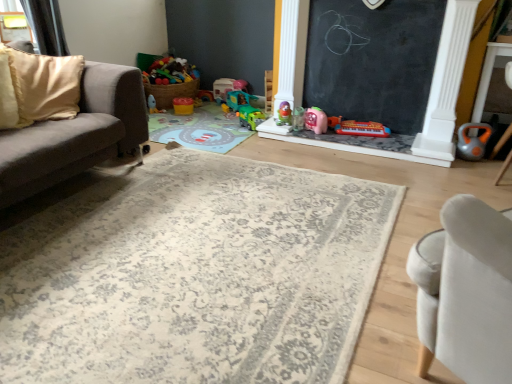
Locate an element on the screen. Image resolution: width=512 pixels, height=384 pixels. pink rubber duck at center, arranged as the eighth toy when viewed from the left is located at coordinates (316, 120).

What do you see at coordinates (316, 120) in the screenshot? This screenshot has height=384, width=512. I see `pink rubber duck at center, positioned as the third toy in right-to-left order` at bounding box center [316, 120].

Describe the element at coordinates (222, 88) in the screenshot. I see `plastic train at upper center, positioned as the 8th toy in right-to-left order` at that location.

Measure the distance between plastic train at upper center, positioned as the 8th toy in right-to-left order, and camera.

3.74 meters.

Locate an element on the screen. The width and height of the screenshot is (512, 384). translucent plastic cup at center, the seventh toy from the left is located at coordinates (298, 119).

Is beige fabric pillow at left not near matte plastic toy at center, which appears as the sixth toy when viewed from the left?

Yes.

Is point (26, 92) behind point (282, 125)?

No.

Considering the sizes of objects beige fabric pillow at left and matte plastic toy at center, the fifth toy from the right, in the image provided, who is taller, beige fabric pillow at left or matte plastic toy at center, the fifth toy from the right,?

With more height is beige fabric pillow at left.

You are a GUI agent. You are given a task and a screenshot of the screen. Output one action in this format:
    pyautogui.click(x=<x>, y=<y>)
    Task: Click on the pillow above the matte plastic toy at center, which appears as the sixth toy when viewed from the left (from a real-world perspective)
    This screenshot has width=512, height=384.
    Given the screenshot: What is the action you would take?
    pyautogui.click(x=37, y=87)

Considering the sizes of objects beige floral rug at center and matte plastic toy at center, which appears as the sixth toy when viewed from the left, in the image provided, who is bigger, beige floral rug at center or matte plastic toy at center, which appears as the sixth toy when viewed from the left,?

Bigger between the two is beige floral rug at center.

From the picture: Between beige floral rug at center and matte plastic toy at center, the fifth toy from the right, which one has smaller width?

Thinner between the two is matte plastic toy at center, the fifth toy from the right.

Does beige floral rug at center contain matte plastic toy at center, the fifth toy from the right?

Definitely not — matte plastic toy at center, the fifth toy from the right, is not inside beige floral rug at center.

Consider the image. Which is behind, beige floral rug at center or matte plastic toy at center, which appears as the sixth toy when viewed from the left?

matte plastic toy at center, which appears as the sixth toy when viewed from the left.

Considering the positions of objects green plastic toy car at center, which ranks as the fifth toy in left-to-right order, and beige fabric couch at left in the image provided, who is behind, green plastic toy car at center, which ranks as the fifth toy in left-to-right order, or beige fabric couch at left?

green plastic toy car at center, which ranks as the fifth toy in left-to-right order, is further away from the camera.

Can you tell me how much green plastic toy car at center, which is the 6th toy from right to left, and beige fabric couch at left differ in facing direction?

The facing directions of green plastic toy car at center, which is the 6th toy from right to left, and beige fabric couch at left are 120 degrees apart.

From a real-world perspective, is green plastic toy car at center, which ranks as the fifth toy in left-to-right order, physically below beige fabric couch at left?

Yes, from a real-world perspective, green plastic toy car at center, which ranks as the fifth toy in left-to-right order, is beneath beige fabric couch at left.

Is green plastic toy car at center, which ranks as the fifth toy in left-to-right order, positioned with its back to beige fabric couch at left?

No, green plastic toy car at center, which ranks as the fifth toy in left-to-right order, is not facing away from beige fabric couch at left.

Between green plastic toy car at center, which is the 6th toy from right to left, and beige fabric pillow at left, which one is positioned behind?

green plastic toy car at center, which is the 6th toy from right to left, is further from the camera.

Is green plastic toy car at center, which ranks as the fifth toy in left-to-right order, aimed at beige fabric pillow at left?

Yes, green plastic toy car at center, which ranks as the fifth toy in left-to-right order, is oriented towards beige fabric pillow at left.

From the image's perspective, which is below, green plastic toy car at center, which ranks as the fifth toy in left-to-right order, or beige fabric pillow at left?

green plastic toy car at center, which ranks as the fifth toy in left-to-right order.

From the image's perspective, who appears lower, plastic train at upper center, positioned as the 8th toy in right-to-left order, or beige fabric pillow at left?

beige fabric pillow at left appears lower in the image.

Is plastic train at upper center, marked as the 3th toy in a left-to-right arrangement, inside the boundaries of beige fabric pillow at left, or outside?

plastic train at upper center, marked as the 3th toy in a left-to-right arrangement, is spatially situated outside beige fabric pillow at left.

Is there a large distance between plastic train at upper center, positioned as the 8th toy in right-to-left order, and beige fabric pillow at left?

Yes, plastic train at upper center, positioned as the 8th toy in right-to-left order, and beige fabric pillow at left are located far from each other.

Based on their positions, is orange rubber kettlebell at right, the tenth toy from the left, located to the left or right of beige fabric pillow at left?

From the image, it's evident that orange rubber kettlebell at right, the tenth toy from the left, is to the right of beige fabric pillow at left.

Looking at this image, is orange rubber kettlebell at right, placed as the 1th toy when sorted from right to left, facing towards beige fabric pillow at left?

No, orange rubber kettlebell at right, placed as the 1th toy when sorted from right to left, does not turn towards beige fabric pillow at left.

Which of these two, orange rubber kettlebell at right, the tenth toy from the left, or beige fabric pillow at left, is bigger?

beige fabric pillow at left is bigger.

Looking at this image, is orange rubber kettlebell at right, placed as the 1th toy when sorted from right to left, not within beige fabric pillow at left?

Yes, orange rubber kettlebell at right, placed as the 1th toy when sorted from right to left, is located beyond the bounds of beige fabric pillow at left.

Based on the photo, considering the sizes of transparent plastic window at upper left and matte plastic toy at upper center, the 10th toy positioned from the right, in the image, is transparent plastic window at upper left wider or thinner than matte plastic toy at upper center, the 10th toy positioned from the right,?

Clearly, transparent plastic window at upper left has less width compared to matte plastic toy at upper center, the 10th toy positioned from the right.

Is transparent plastic window at upper left far from matte plastic toy at upper center, the 10th toy positioned from the right?

Yes, transparent plastic window at upper left is far from matte plastic toy at upper center, the 10th toy positioned from the right.

Is transparent plastic window at upper left aimed at matte plastic toy at upper center, which ranks as the 1th toy in left-to-right order?

No.

Locate an element on the screen. pillow above the matte plastic toy at center, which appears as the sixth toy when viewed from the left (from a real-world perspective) is located at coordinates coord(37,87).

Identify the location of the 6th toy above the beige floral rug at center (from the image's perspective). (284, 114).

When comparing their distances from green plastic toy car at center, placed as the seventh toy when sorted from right to left, does yellow plastic cup at center, placed as the second toy when sorted from left to right, or beige fabric pillow at left seem closer?

The object closer to green plastic toy car at center, placed as the seventh toy when sorted from right to left, is yellow plastic cup at center, placed as the second toy when sorted from left to right.

Consider the image. Considering their positions, is red plastic toy piano at center, the 2th toy from the right, positioned further to orange rubber kettlebell at right, the tenth toy from the left, than beige floral rug at center?

beige floral rug at center.

Which object lies nearer to the anchor point green plastic toy car at center, which ranks as the 4th toy in left-to-right order, pink rubber duck at center, positioned as the third toy in right-to-left order, or beige floral rug at center?

The object closer to green plastic toy car at center, which ranks as the 4th toy in left-to-right order, is pink rubber duck at center, positioned as the third toy in right-to-left order.

Based on their spatial positions, is plastic train at upper center, positioned as the 8th toy in right-to-left order, or beige fabric couch at left further from green plastic toy car at center, which is the 6th toy from right to left?

Among the two, beige fabric couch at left is located further to green plastic toy car at center, which is the 6th toy from right to left.

Estimate the real-world distances between objects in this image. Which object is further from beige floral rug at center, transparent plastic window at upper left or matte plastic toy at center, the fifth toy from the right?

transparent plastic window at upper left lies further to beige floral rug at center than the other object.

Based on their spatial positions, is transparent plastic window at upper left or green plastic toy car at center, which ranks as the 4th toy in left-to-right order, further from pink rubber duck at center, positioned as the third toy in right-to-left order?

Among the two, transparent plastic window at upper left is located further to pink rubber duck at center, positioned as the third toy in right-to-left order.

Based on their spatial positions, is pink rubber duck at center, positioned as the third toy in right-to-left order, or green plastic toy car at center, which ranks as the 4th toy in left-to-right order, further from matte plastic toy at center, which appears as the sixth toy when viewed from the left?

green plastic toy car at center, which ranks as the 4th toy in left-to-right order, is positioned further to the anchor matte plastic toy at center, which appears as the sixth toy when viewed from the left.

Considering their positions, is translucent plastic cup at center, which appears as the 4th toy when viewed from the right, positioned further to yellow plastic cup at center, placed as the second toy when sorted from left to right, than orange rubber kettlebell at right, the tenth toy from the left?

orange rubber kettlebell at right, the tenth toy from the left, is further to yellow plastic cup at center, placed as the second toy when sorted from left to right.

You are a GUI agent. You are given a task and a screenshot of the screen. Output one action in this format:
    pyautogui.click(x=<x>, y=<y>)
    Task: Click on the pillow between beige fabric couch at left and yellow plastic cup at center, positioned as the ninth toy in right-to-left order, from front to back
    Image resolution: width=512 pixels, height=384 pixels.
    Given the screenshot: What is the action you would take?
    pyautogui.click(x=37, y=87)

Where is `pillow between transparent plastic window at upper left and green plastic toy car at center, which ranks as the fifth toy in left-to-right order, in the horizontal direction`? pillow between transparent plastic window at upper left and green plastic toy car at center, which ranks as the fifth toy in left-to-right order, in the horizontal direction is located at coordinates [37, 87].

Where is `mat between beige fabric couch at left and orange rubber kettlebell at right, the tenth toy from the left, in the horizontal direction`? Image resolution: width=512 pixels, height=384 pixels. mat between beige fabric couch at left and orange rubber kettlebell at right, the tenth toy from the left, in the horizontal direction is located at coordinates (194, 275).

The image size is (512, 384). What are the coordinates of `pillow between beige fabric couch at left and translucent plastic cup at center, which appears as the 4th toy when viewed from the right, in the horizontal direction` in the screenshot? It's located at (37, 87).